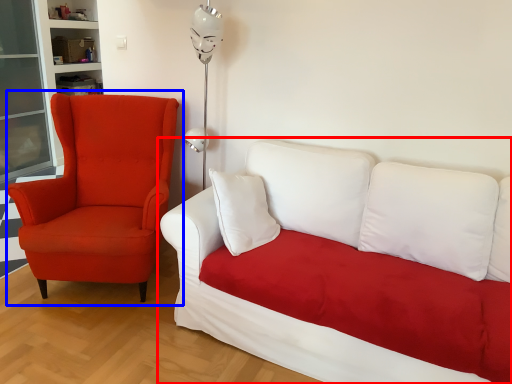
Question: Which object is closer to the camera taking this photo, studio couch (highlighted by a red box) or chair (highlighted by a blue box)?

Choices:
 (A) studio couch
 (B) chair

Answer: (A)